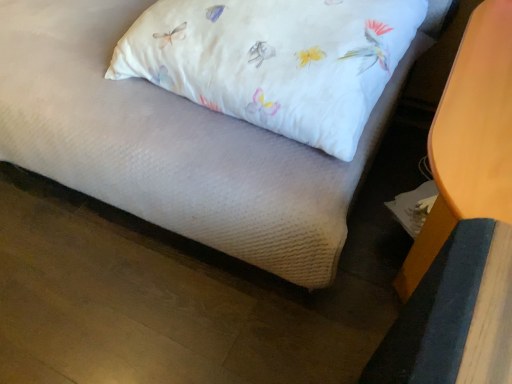
In the scene shown: In order to face white fabric pillow at upper center, should I rotate leftwards or rightwards?

Turn right approximately 1.327 degrees to face it.

The image size is (512, 384). I want to click on white fabric pillow at upper center, so click(x=275, y=60).

What do you see at coordinates (275, 60) in the screenshot?
I see `white fabric pillow at upper center` at bounding box center [275, 60].

The image size is (512, 384). What do you see at coordinates (469, 139) in the screenshot? I see `matte wood table at lower right` at bounding box center [469, 139].

At what (x,y) coordinates should I click in order to perform the action: click on matte wood table at lower right. Please return your answer as a coordinate pair (x, y). Image resolution: width=512 pixels, height=384 pixels. Looking at the image, I should click on (469, 139).

At what (x,y) coordinates should I click in order to perform the action: click on white fabric pillow at upper center. Please return your answer as a coordinate pair (x, y). The height and width of the screenshot is (384, 512). Looking at the image, I should click on (275, 60).

Considering the positions of objects white fabric pillow at upper center and matte wood table at lower right in the image provided, who is more to the left, white fabric pillow at upper center or matte wood table at lower right?

Positioned to the left is white fabric pillow at upper center.

Considering the relative positions of white fabric pillow at upper center and matte wood table at lower right in the image provided, is white fabric pillow at upper center behind matte wood table at lower right?

Yes, white fabric pillow at upper center is behind matte wood table at lower right.

Is point (223, 54) in front of point (431, 162)?

No, it is not.

From the image's perspective, is white fabric pillow at upper center below matte wood table at lower right?

Incorrect, from the image's perspective, white fabric pillow at upper center is higher than matte wood table at lower right.

From a real-world perspective, is white fabric pillow at upper center physically above matte wood table at lower right?

Indeed, from a real-world perspective, white fabric pillow at upper center stands above matte wood table at lower right.

Does white fabric pillow at upper center have a greater width compared to matte wood table at lower right?

Yes, white fabric pillow at upper center is wider than matte wood table at lower right.

Which of these two, white fabric pillow at upper center or matte wood table at lower right, stands taller?

matte wood table at lower right is taller.

Which of these two, white fabric pillow at upper center or matte wood table at lower right, is smaller?

white fabric pillow at upper center.

Is white fabric pillow at upper center positioned beyond the bounds of matte wood table at lower right?

Yes, white fabric pillow at upper center is outside of matte wood table at lower right.

Is white fabric pillow at upper center beside matte wood table at lower right?

white fabric pillow at upper center and matte wood table at lower right are clearly separated.

Is matte wood table at lower right at the back of white fabric pillow at upper center?

No, white fabric pillow at upper center is not facing away from matte wood table at lower right.

What's the angular difference between white fabric pillow at upper center and matte wood table at lower right's facing directions?

87.3 degrees.

I want to click on pillow on the left of the matte wood table at lower right, so click(275, 60).

Which is more to the right, matte wood table at lower right or white fabric pillow at upper center?

matte wood table at lower right is more to the right.

Is matte wood table at lower right behind white fabric pillow at upper center?

No, it is not.

Is point (510, 51) closer to viewer compared to point (217, 91)?

Yes.

From the image's perspective, between matte wood table at lower right and white fabric pillow at upper center, which one is located above?

From the image's view, white fabric pillow at upper center is above.

From a real-world perspective, is matte wood table at lower right physically located above or below white fabric pillow at upper center?

matte wood table at lower right is below white fabric pillow at upper center.

Which of these two, matte wood table at lower right or white fabric pillow at upper center, is thinner?

With smaller width is matte wood table at lower right.

Does matte wood table at lower right have a lesser height compared to white fabric pillow at upper center?

Incorrect, the height of matte wood table at lower right does not fall short of that of white fabric pillow at upper center.

Does matte wood table at lower right have a larger size compared to white fabric pillow at upper center?

Indeed, matte wood table at lower right has a larger size compared to white fabric pillow at upper center.

Is matte wood table at lower right located outside white fabric pillow at upper center?

matte wood table at lower right lies outside white fabric pillow at upper center's area.

Is matte wood table at lower right not near white fabric pillow at upper center?

No, matte wood table at lower right is not far from white fabric pillow at upper center.

Could you tell me if matte wood table at lower right is facing white fabric pillow at upper center?

Yes, matte wood table at lower right is facing white fabric pillow at upper center.

What's the angular difference between matte wood table at lower right and white fabric pillow at upper center's facing directions?

The facing directions of matte wood table at lower right and white fabric pillow at upper center are 87.3 degrees apart.

Identify the location of furniture located below the white fabric pillow at upper center (from the image's perspective). This screenshot has height=384, width=512. (469, 139).

Where is `furniture in front of the white fabric pillow at upper center`? furniture in front of the white fabric pillow at upper center is located at coordinates (469, 139).

Image resolution: width=512 pixels, height=384 pixels. I want to click on pillow on the left of matte wood table at lower right, so click(x=275, y=60).